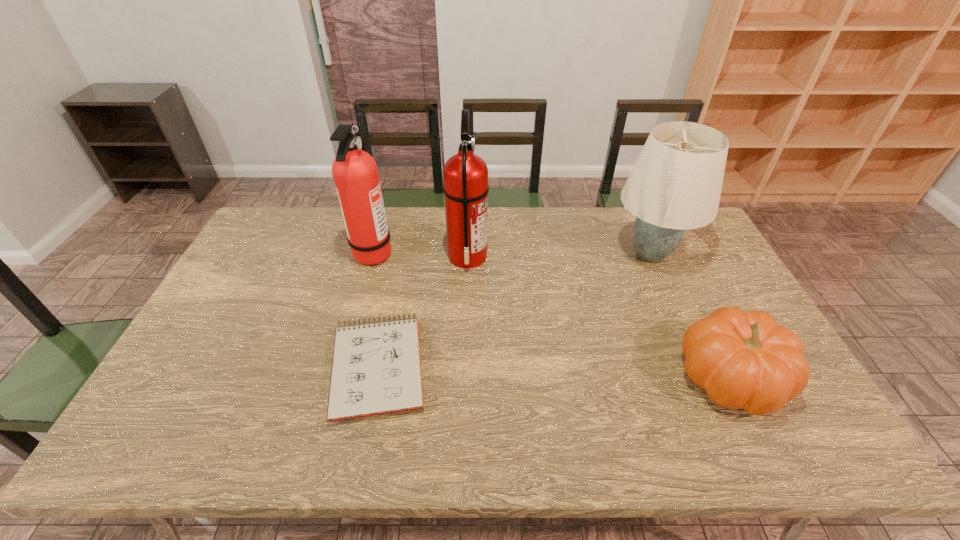
Find the location of `lampshade present at the far edge`. lampshade present at the far edge is located at coordinates (676, 182).

Find the location of a particular element. pumpkin located at the near edge is located at coordinates (744, 360).

Where is `notepad positioned at the near edge`? notepad positioned at the near edge is located at coordinates 376,368.

This screenshot has width=960, height=540. I want to click on lampshade present at the right edge, so click(676, 182).

Locate an element on the screen. The image size is (960, 540). pumpkin situated at the right edge is located at coordinates (744, 360).

At what (x,y) coordinates should I click in order to perform the action: click on object that is at the far right corner. Please return your answer as a coordinate pair (x, y). The width and height of the screenshot is (960, 540). Looking at the image, I should click on (676, 182).

The height and width of the screenshot is (540, 960). Identify the location of object positioned at the near right corner. click(x=744, y=360).

Locate an element on the screen. The width and height of the screenshot is (960, 540). free space at the far edge of the desktop is located at coordinates (517, 221).

In the image, there is a desktop. Identify the location of vacant space at the near edge. Image resolution: width=960 pixels, height=540 pixels. (656, 430).

In the image, there is a desktop. Identify the location of vacant space at the left edge. (233, 362).